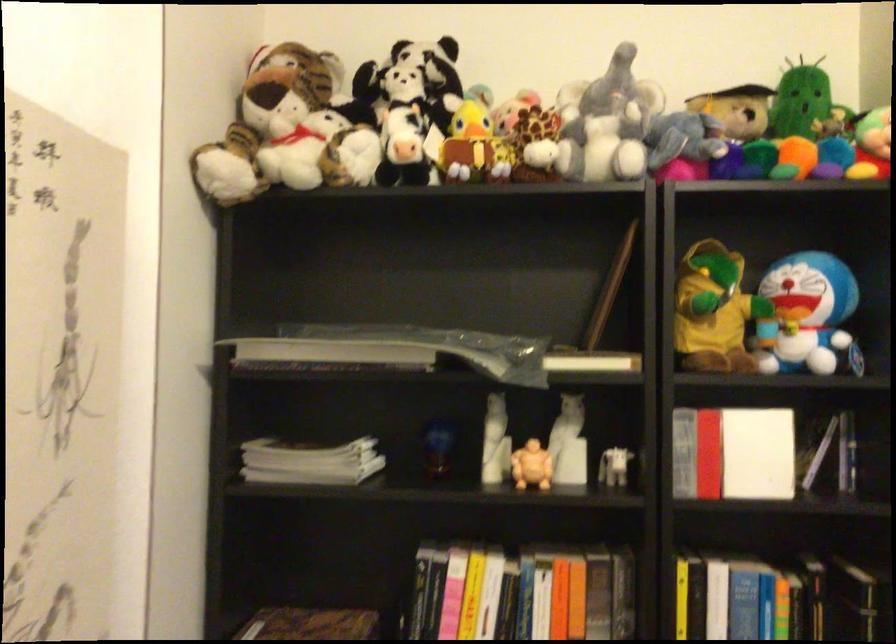
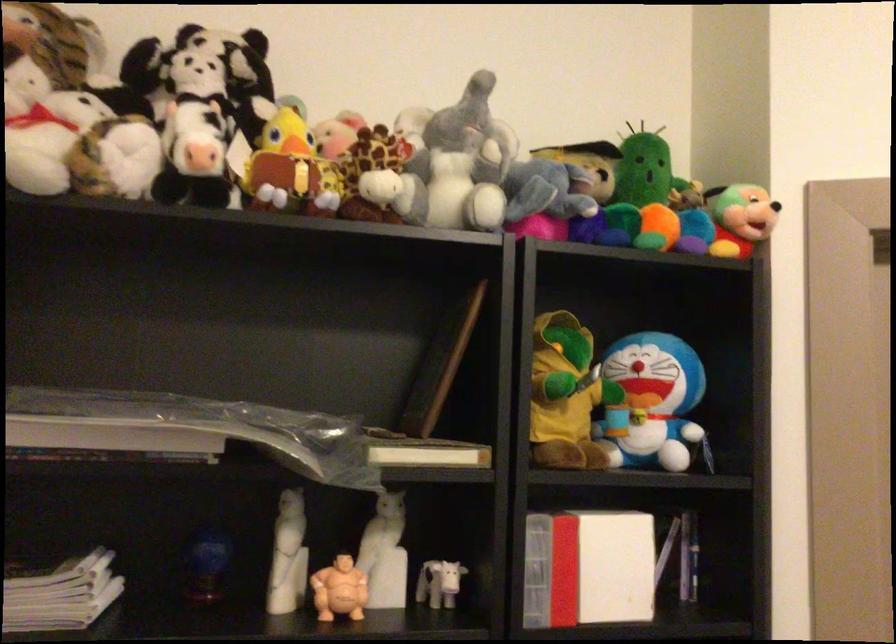
Where in the second image is the point corresponding to point 529,466 from the first image?

(339, 589)